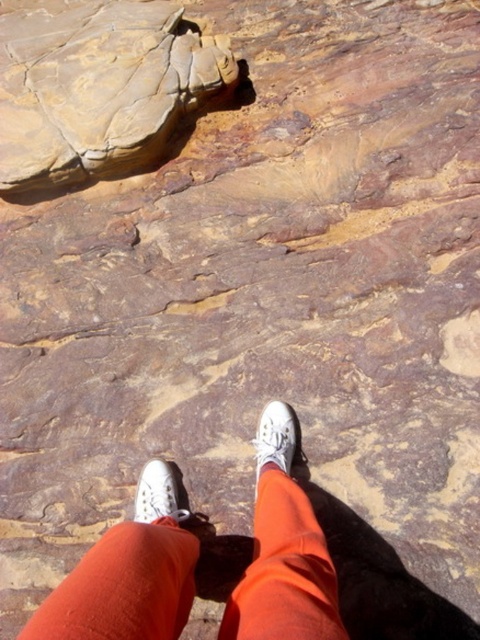
Question: Is white canvas shoes at center positioned behind white canvas shoe at center?

Choices:
 (A) no
 (B) yes

Answer: (A)

Question: Among these objects, which one is farthest from the camera?

Choices:
 (A) white canvas shoe at center
 (B) white canvas shoes at center

Answer: (A)

Question: Which of these objects is positioned farthest from the white canvas shoe at lower center?

Choices:
 (A) matte brown rock at upper left
 (B) white canvas shoe at center

Answer: (A)

Question: Can you confirm if white canvas shoes at center is smaller than white canvas shoe at lower center?

Choices:
 (A) no
 (B) yes

Answer: (A)

Question: Which of the following is the farthest from the observer?

Choices:
 (A) white canvas shoe at center
 (B) white canvas shoes at center
 (C) matte brown rock at upper left
 (D) white canvas shoe at lower center

Answer: (C)

Question: Is white canvas shoes at center smaller than white canvas shoe at center?

Choices:
 (A) no
 (B) yes

Answer: (A)